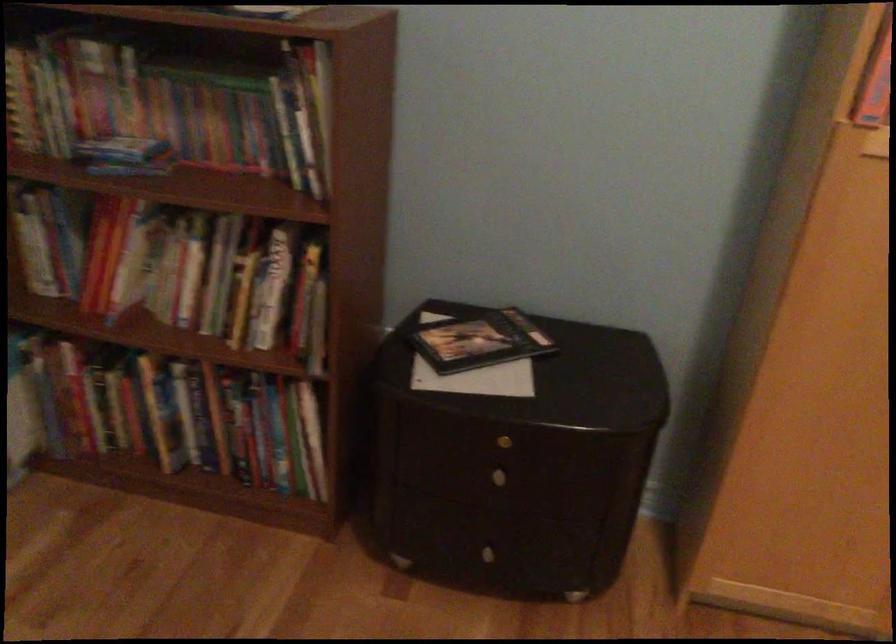
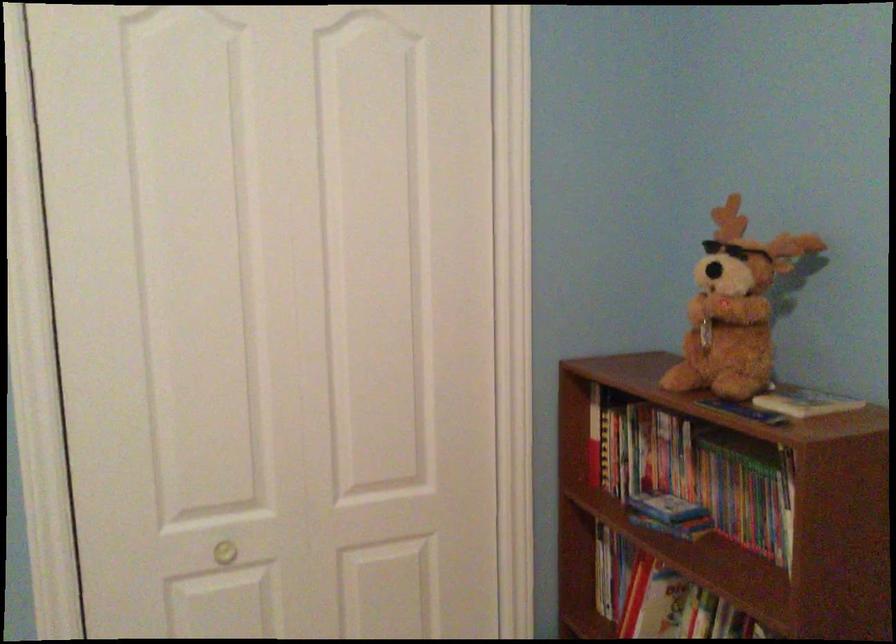
Question: The first image is from the beginning of the video and the second image is from the end. How did the camera likely rotate when shooting the video?

Choices:
 (A) Left
 (B) Right
 (C) Up
 (D) Down

Answer: (A)